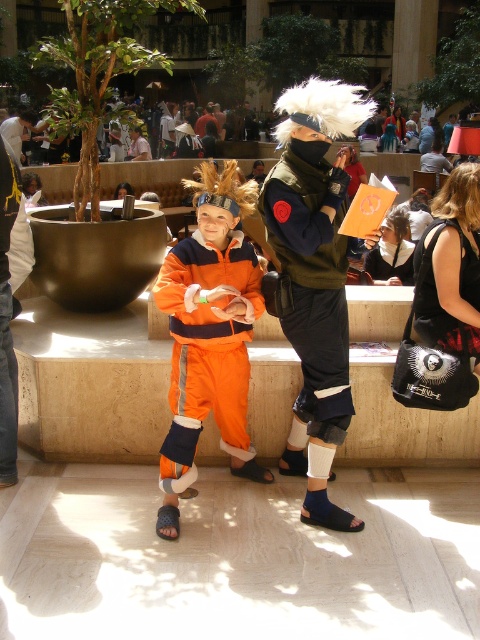
Question: Which of the following is the closest to the observer?

Choices:
 (A) (300, 97)
 (B) (456, 188)
 (C) (262, 308)

Answer: (A)

Question: Can you confirm if orange fabric pants at center is wider than matte black mask at upper center?

Choices:
 (A) yes
 (B) no

Answer: (B)

Question: Can you confirm if orange fabric pants at center is thinner than dark red fabric shirt at center?

Choices:
 (A) no
 (B) yes

Answer: (A)

Question: Which point appears farthest from the camera in this image?

Choices:
 (A) (314, 244)
 (B) (187, 252)

Answer: (B)

Question: Does orange fabric pants at center have a larger size compared to dark red fabric shirt at center?

Choices:
 (A) yes
 (B) no

Answer: (A)

Question: Which object appears closest to the camera in this image?

Choices:
 (A) dark red fabric shirt at center
 (B) black leather purse at lower right

Answer: (B)